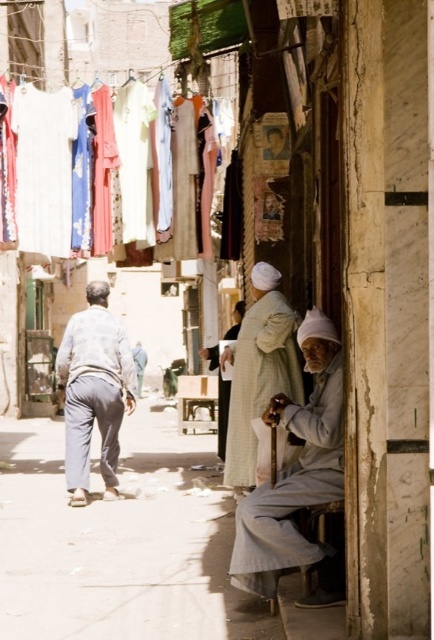
Is light gray cotton robe at lower right positioned at the back of light beige fabric robe at center?

No, it is not.

Can you confirm if light gray cotton robe at lower right is wider than light beige fabric robe at center?

Incorrect, light gray cotton robe at lower right's width does not surpass light beige fabric robe at center's.

This screenshot has height=640, width=434. What do you see at coordinates (293, 486) in the screenshot?
I see `light gray cotton robe at lower right` at bounding box center [293, 486].

Find the location of a particular element. light gray cotton robe at lower right is located at coordinates (293, 486).

Between light gray cotton pants at center and light beige fabric at center, which one has less height?

Standing shorter between the two is light beige fabric at center.

Who is more distant from viewer, (104, 321) or (246, 406)?

Point (104, 321)

This screenshot has height=640, width=434. In order to click on light gray cotton pants at center in this screenshot , I will do `click(94, 390)`.

Can you confirm if floral fabric dresses at upper left is positioned below light gray cotton pants at center?

No.

Does point (62, 205) come in front of point (85, 384)?

No, (62, 205) is further to viewer.

Which is in front, point (39, 172) or point (72, 403)?

Positioned in front is point (72, 403).

This screenshot has height=640, width=434. Identify the location of floral fabric dresses at upper left. (158, 170).